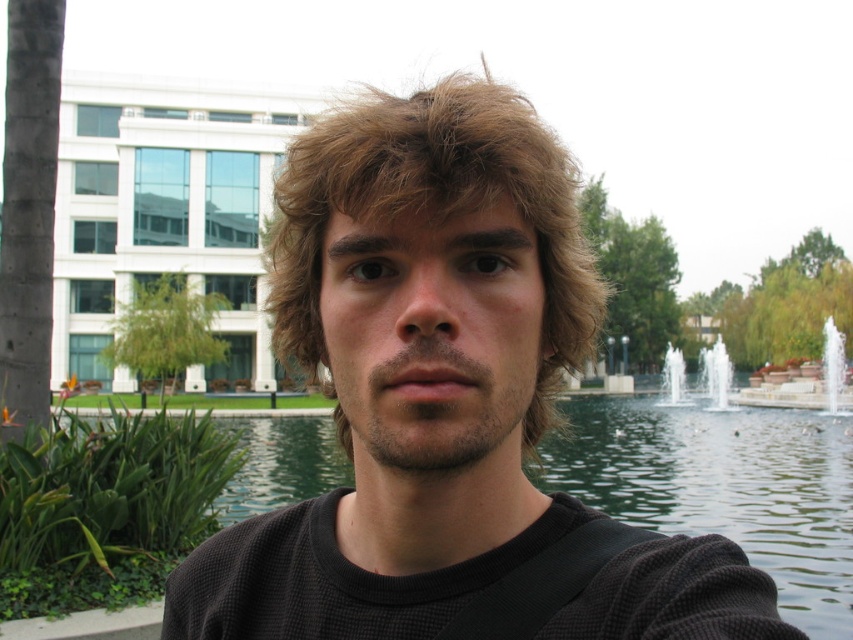
You are standing at the point where the person is taking a selfie in the park. There is a clear glass water at center located at point (717, 374). If you want to walk towards the clear glass water at center, which direction should you head?

The clear glass water at center is located at point (717, 374), so you should head towards that coordinate to reach it.

You are standing in the park and see the black mesh shirt at center and the green water at center. Which object is positioned to the left?

The black mesh shirt at center is to the left of the green water at center.

You are standing in the park and see the black mesh shirt at center and the green water at center. Which object is nearer to you?

The black mesh shirt at center is closer to the viewer than the green water at center.